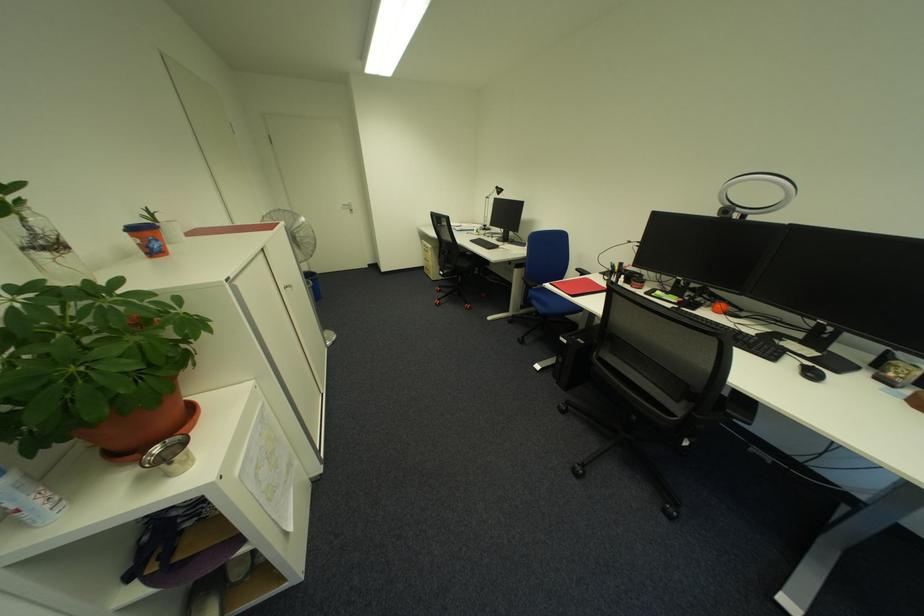
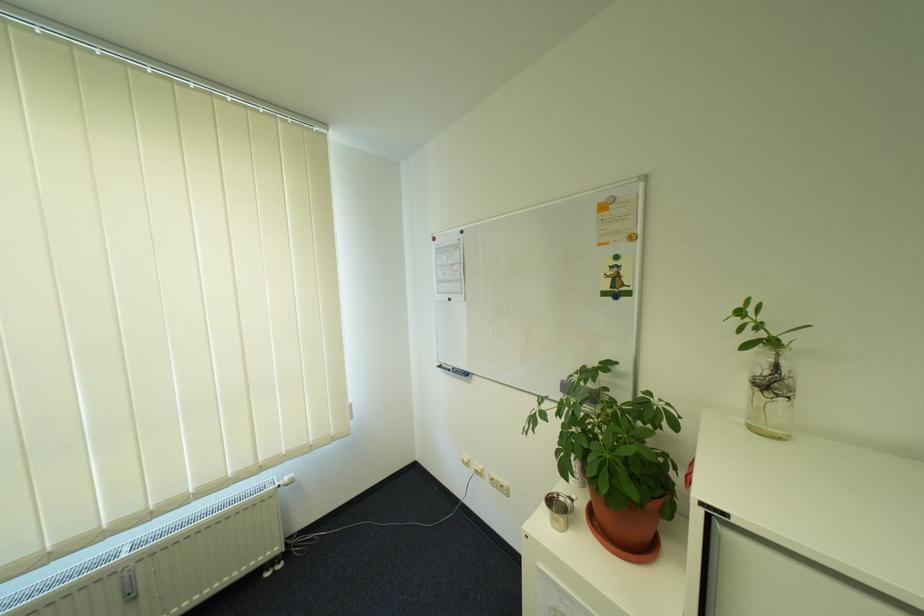
Locate, in the second image, the point that corresponds to point (40, 230) in the first image.

(785, 369)